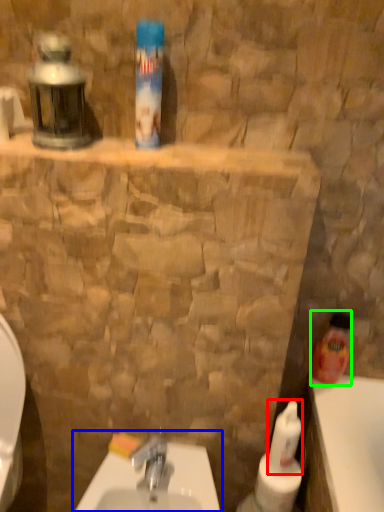
Question: Which object is the farthest from cleaning product (highlighted by a red box)? Choose among these: sink (highlighted by a blue box) or cleaning product (highlighted by a green box).

Choices:
 (A) sink
 (B) cleaning product

Answer: (A)